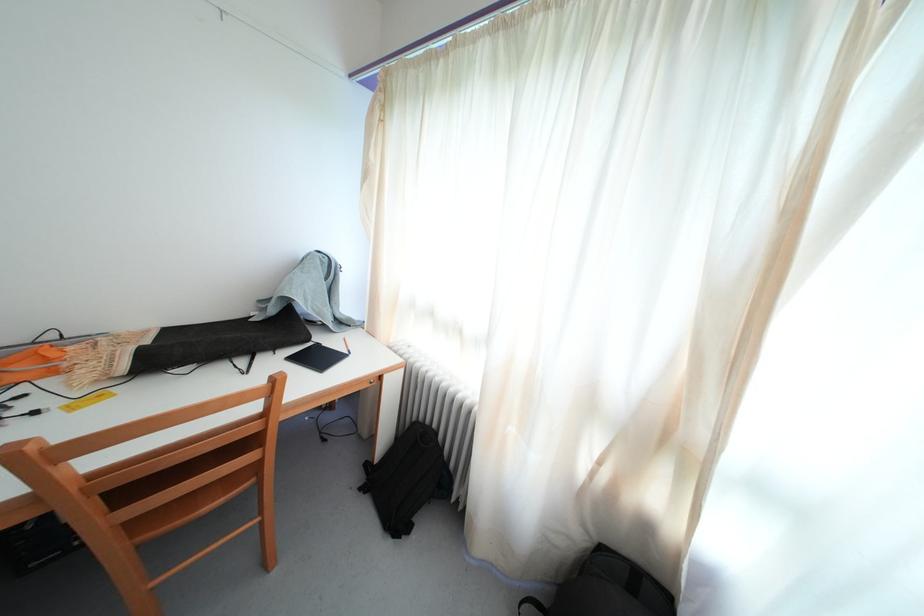
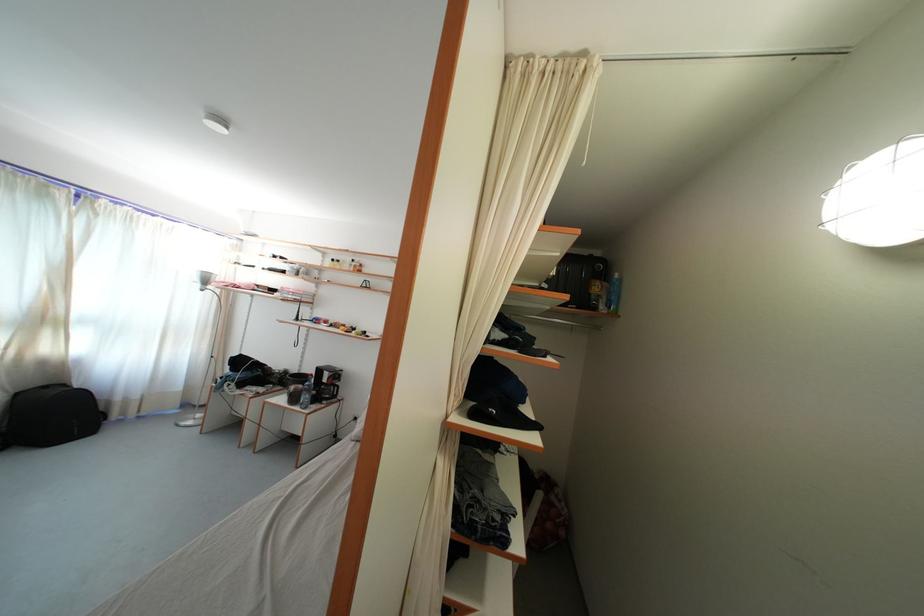
Where in the second image is the point corresponding to (608,553) from the first image?

(23, 400)